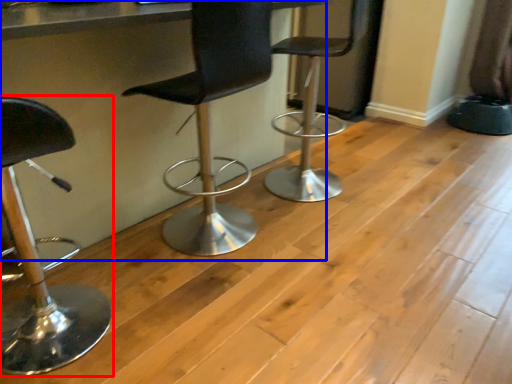
Question: Among these objects, which one is nearest to the camera, chair (highlighted by a red box) or table (highlighted by a blue box)?

Choices:
 (A) chair
 (B) table

Answer: (A)